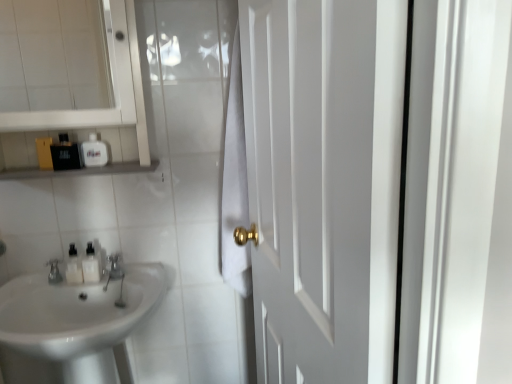
Question: Considering the positions of matte black bottle at upper left, the 3th toiletry ordered from the bottom, and brushed metal faucet at lower left in the image, is matte black bottle at upper left, the 3th toiletry ordered from the bottom, bigger or smaller than brushed metal faucet at lower left?

Choices:
 (A) small
 (B) big

Answer: (A)

Question: Considering the positions of point tap(75, 148) and point tap(110, 258), is point tap(75, 148) closer or farther from the camera than point tap(110, 258)?

Choices:
 (A) closer
 (B) farther

Answer: (A)

Question: Which object is the farthest from the white glossy soap dispenser at upper left?

Choices:
 (A) white glossy bottles at left, which is the 1th toiletry from bottom to top
 (B) white glossy medicine cabinet at upper left
 (C) white glossy soap dispenser at left, which is counted as the 2th toiletry, starting from the top
 (D) black plastic container at upper left
 (E) matte black bottle at upper left, the 3th toiletry ordered from the bottom

Answer: (A)

Question: Based on their relative distances, which object is nearer to the white glossy bottles at left, which is counted as the third toiletry, starting from the top?

Choices:
 (A) matte black bottle at upper left, which appears as the 1th toiletry when viewed from the top
 (B) white matte door at right
 (C) brushed metal faucet at lower left
 (D) white glossy sink at lower left
 (E) black plastic container at upper left

Answer: (C)